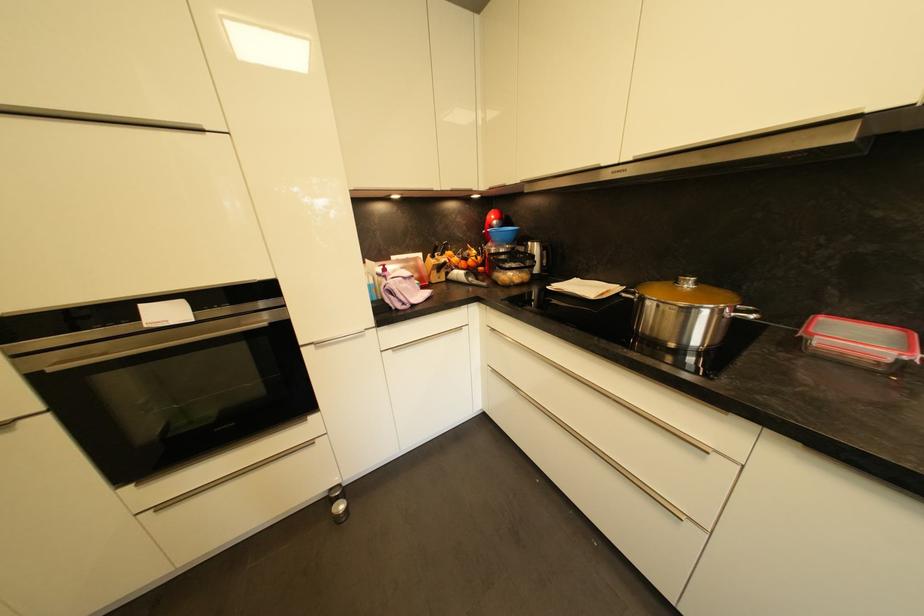
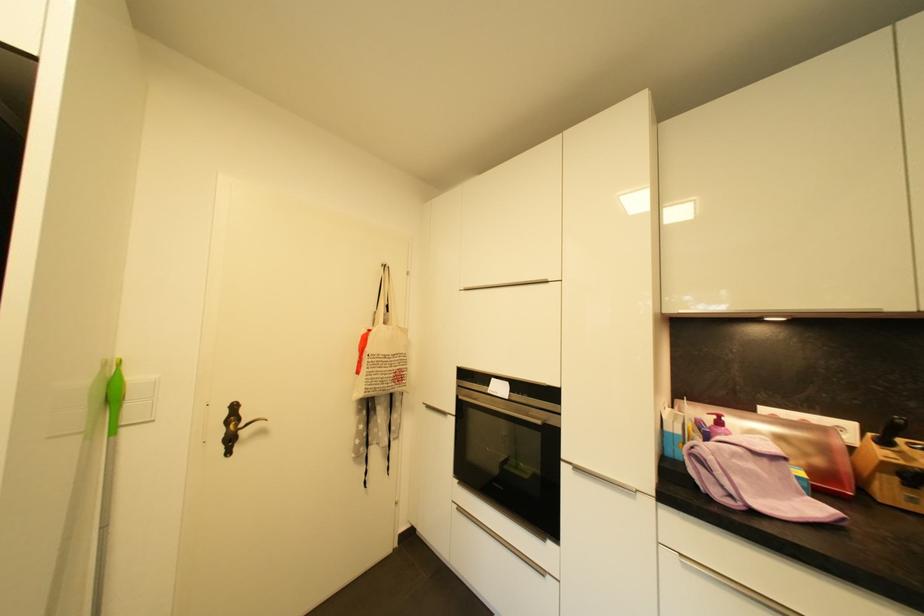
In the second image, find the point that corresponds to point 56,371 in the first image.

(466, 399)